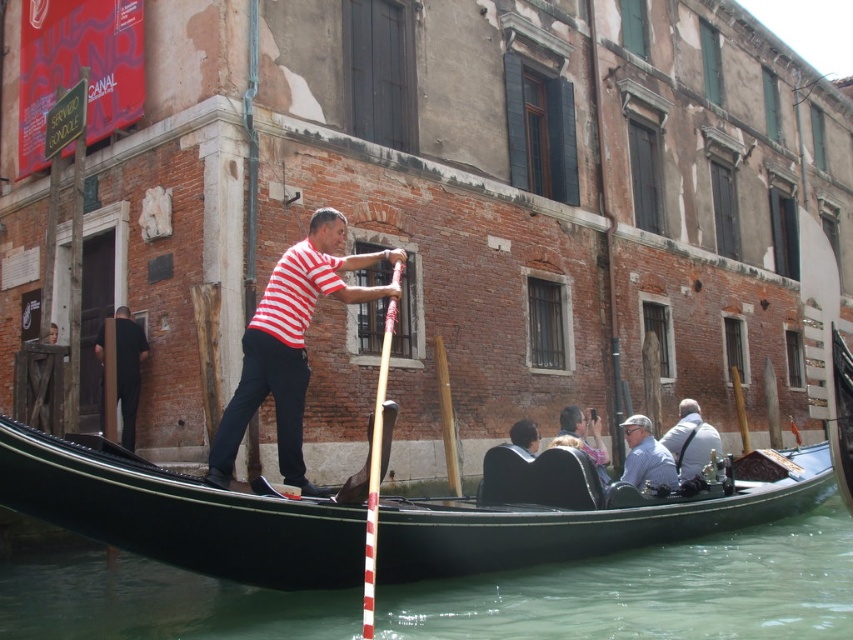
Question: From the image, what is the correct spatial relationship of black glossy water at lower center in relation to striped cotton shirt at center?

Choices:
 (A) above
 (B) below

Answer: (B)

Question: Is black polished wood gondola at center smaller than light blue shirt at center?

Choices:
 (A) yes
 (B) no

Answer: (B)

Question: Is black glossy water at lower center smaller than white leather jacket at center?

Choices:
 (A) yes
 (B) no

Answer: (B)

Question: Which point is farther from the camera taking this photo?

Choices:
 (A) (444, 515)
 (B) (421, 630)

Answer: (A)

Question: Which point is farther from the camera taking this photo?

Choices:
 (A) (335, 296)
 (B) (715, 438)
 (C) (236, 609)

Answer: (B)

Question: Which point is farther to the camera?

Choices:
 (A) click(x=181, y=602)
 (B) click(x=694, y=406)
 (C) click(x=67, y=481)
 (D) click(x=132, y=371)

Answer: (B)